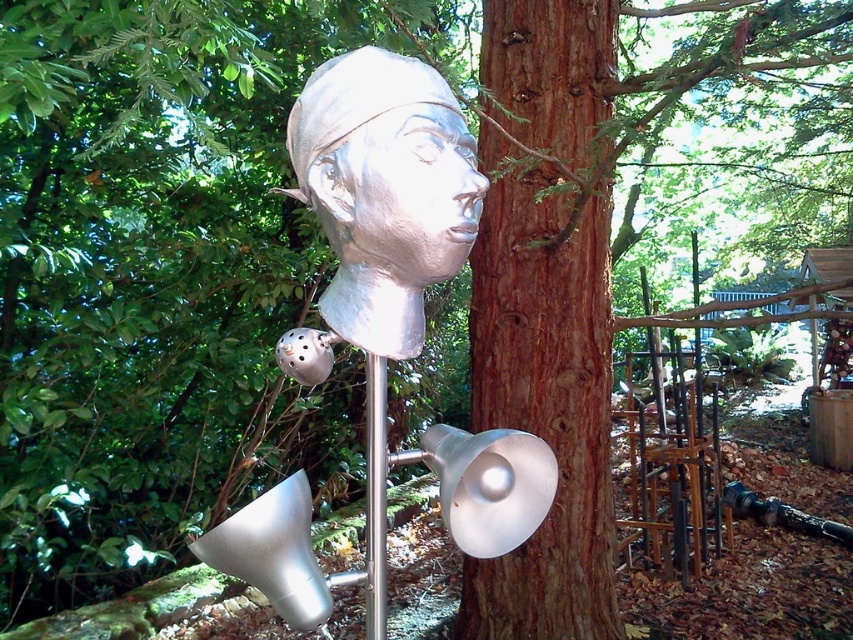
You are an artist planning to paint the scene. You notice the brown rough bark at center and the satin silver head at center. Which object should you focus on first if you want to paint the larger object first?

The brown rough bark at center is larger in size than the satin silver head at center, so you should focus on painting the brown rough bark at center first.

You are a maintenance worker who needs to check the connection between the satin silver head at center and the silver metallic pole at center. The tools you have can reach up to 6 inches. Can you reach the connection point without moving the tools closer?

The distance between the satin silver head at center and the silver metallic pole at center is 6.97 inches, which is slightly more than the tool reach of 6 inches. Therefore, you cannot reach the connection point without moving closer.

You are a gardener standing in the garden and want to water both the brown rough bark at center and the satin silver head at center. Which object should you water first if you want to reach them in the order closest to farthest from your current position?

You should water the brown rough bark at center first because it is closer to you than the satin silver head at center, which is further away.